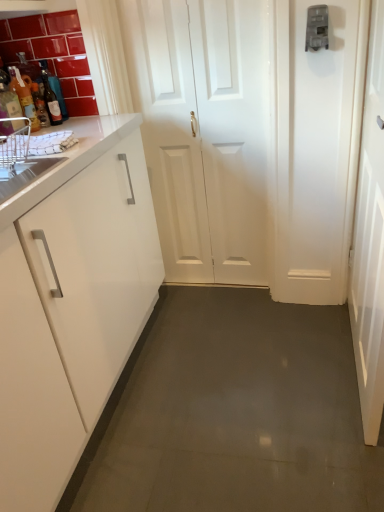
Question: Can you confirm if white glossy door at right, arranged as the first door when viewed from the right, is smaller than white glossy door at center, acting as the 2th door starting from the right?

Choices:
 (A) no
 (B) yes

Answer: (A)

Question: From a real-world perspective, is white glossy door at right, the second door from the left, physically below white glossy door at center, which is the 1th door in left-to-right order?

Choices:
 (A) no
 (B) yes

Answer: (B)

Question: Can you see white glossy door at right, the second door from the left, touching white glossy door at center, which is the 1th door in left-to-right order?

Choices:
 (A) no
 (B) yes

Answer: (A)

Question: Is white glossy door at right, the second door from the left, at the right side of white glossy door at center, acting as the 2th door starting from the right?

Choices:
 (A) no
 (B) yes

Answer: (B)

Question: Considering their positions, is white glossy sink at left located in front of or behind translucent glass bottle at left, the second bottle viewed from the left?

Choices:
 (A) behind
 (B) front

Answer: (B)

Question: From a real-world perspective, relative to translucent glass bottle at left, marked as the second bottle in a right-to-left arrangement, is white glossy sink at left vertically above or below?

Choices:
 (A) above
 (B) below

Answer: (B)

Question: Is white glossy sink at left bigger or smaller than translucent glass bottle at left, marked as the second bottle in a right-to-left arrangement?

Choices:
 (A) small
 (B) big

Answer: (B)

Question: From the image's perspective, is white glossy sink at left located above or below translucent glass bottle at left, marked as the second bottle in a right-to-left arrangement?

Choices:
 (A) above
 (B) below

Answer: (B)

Question: Does point (26, 86) appear closer or farther from the camera than point (34, 177)?

Choices:
 (A) farther
 (B) closer

Answer: (A)

Question: Do you think translucent glass bottle at left, the second bottle viewed from the left, is within white glossy sink at left, or outside of it?

Choices:
 (A) outside
 (B) inside

Answer: (A)

Question: Looking at their shapes, would you say translucent glass bottle at left, marked as the second bottle in a right-to-left arrangement, is wider or thinner than white glossy sink at left?

Choices:
 (A) wide
 (B) thin

Answer: (B)

Question: Considering the positions of translucent glass bottle at left, the second bottle viewed from the left, and white glossy sink at left in the image, is translucent glass bottle at left, the second bottle viewed from the left, bigger or smaller than white glossy sink at left?

Choices:
 (A) small
 (B) big

Answer: (A)

Question: In terms of size, does white glossy door at center, acting as the 2th door starting from the right, appear bigger or smaller than white glossy sink at left?

Choices:
 (A) big
 (B) small

Answer: (A)

Question: From a real-world perspective, relative to white glossy sink at left, is white glossy door at center, which is the 1th door in left-to-right order, vertically above or below?

Choices:
 (A) below
 (B) above

Answer: (A)